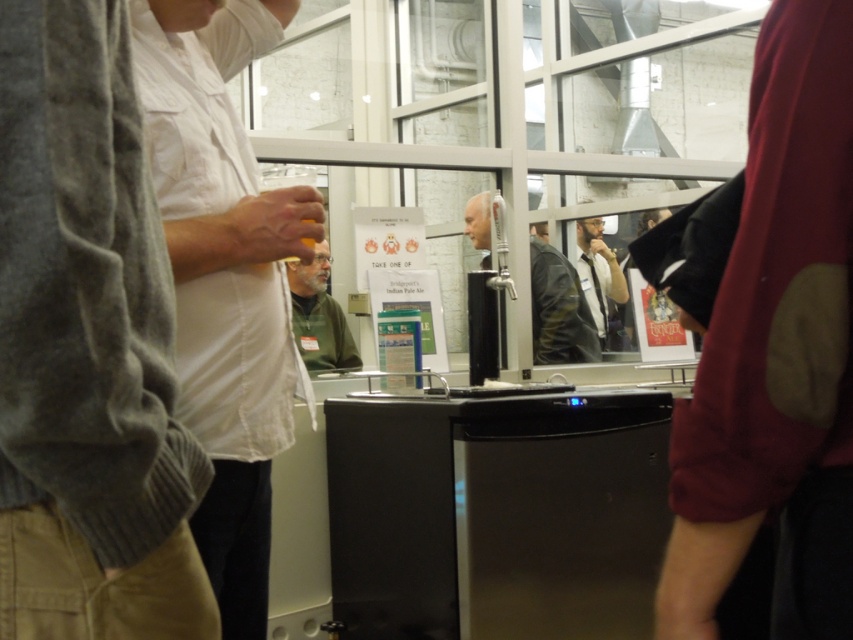
Based on the photo, is knitted gray sweater at left above white matte shirt at center?

Incorrect, knitted gray sweater at left is not positioned above white matte shirt at center.

Between knitted gray sweater at left and white matte shirt at center, which one appears on the left side from the viewer's perspective?

Positioned to the left is knitted gray sweater at left.

Find the location of a particular element. The width and height of the screenshot is (853, 640). knitted gray sweater at left is located at coordinates (86, 348).

The width and height of the screenshot is (853, 640). Describe the element at coordinates (558, 308) in the screenshot. I see `leather jacket at center` at that location.

Is point (585, 328) positioned after point (328, 250)?

No.

Between point (544, 323) and point (306, 323), which one is positioned behind?

The point (544, 323) is behind.

You are a GUI agent. You are given a task and a screenshot of the screen. Output one action in this format:
    pyautogui.click(x=<x>, y=<y>)
    Task: Click on the leather jacket at center
    This screenshot has width=853, height=640.
    Given the screenshot: What is the action you would take?
    pyautogui.click(x=558, y=308)

Does leather jacket at center have a greater height compared to black leather jacket at center?

Yes.

Which is more to the left, leather jacket at center or black leather jacket at center?

Positioned to the left is leather jacket at center.

Is point (531, 268) positioned before point (596, 244)?

Yes, it is in front of point (596, 244).

This screenshot has height=640, width=853. What are the coordinates of `leather jacket at center` in the screenshot? It's located at (558, 308).